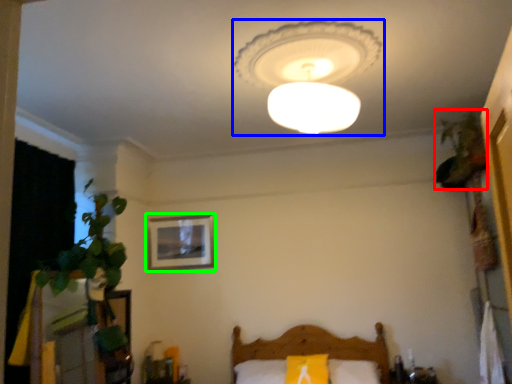
Question: Estimate the real-world distances between objects in this image. Which object is closer to plant (highlighted by a red box), lamp (highlighted by a blue box) or picture frame (highlighted by a green box)?

Choices:
 (A) lamp
 (B) picture frame

Answer: (A)